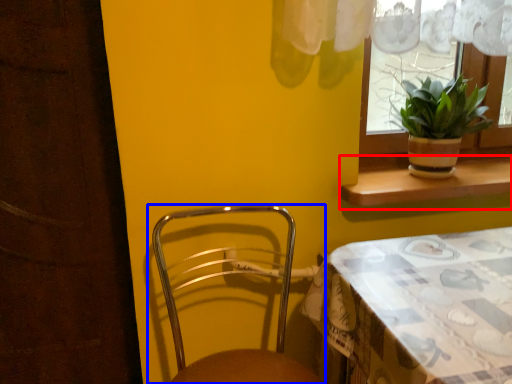
Question: Which point is closer to the camera, window sill (highlighted by a red box) or chair (highlighted by a blue box)?

Choices:
 (A) window sill
 (B) chair

Answer: (B)